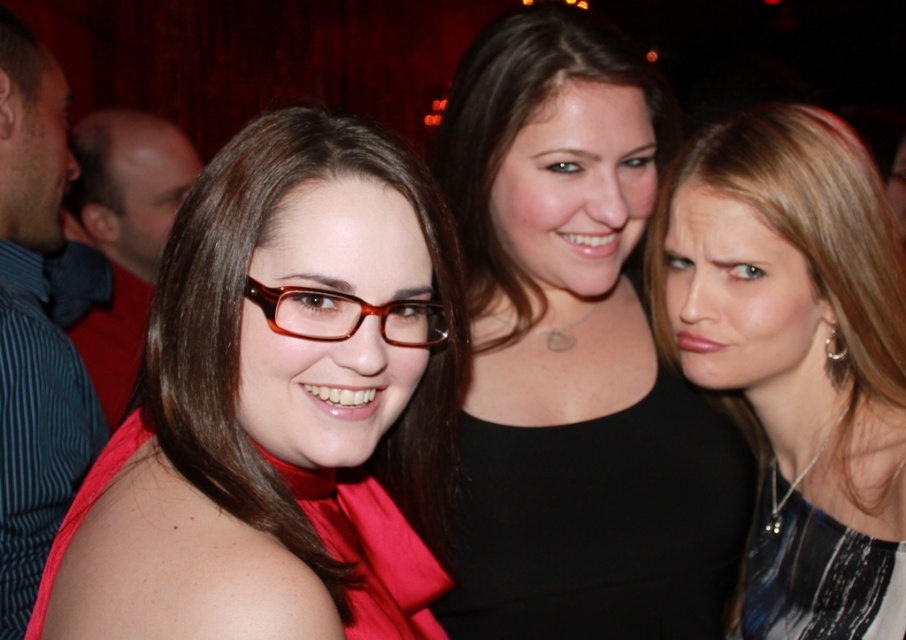
Is point (388, 260) closer to viewer compared to point (400, 305)?

Yes, point (388, 260) is in front of point (400, 305).

Is matte red glasses at center above brown glossy glasses at center?

Incorrect, matte red glasses at center is not positioned above brown glossy glasses at center.

Who is more distant from viewer, [340,618] or [435,320]?

The point [435,320] is more distant.

Locate an element on the screen. The height and width of the screenshot is (640, 906). matte red glasses at center is located at coordinates (281, 404).

Is shiny silver necklace at upper right shorter than black silk dress at lower right?

No.

Which is behind, point (776, 449) or point (895, 554)?

Point (776, 449)

Where is `shiny silver necklace at upper right`? Image resolution: width=906 pixels, height=640 pixels. shiny silver necklace at upper right is located at coordinates (796, 358).

Based on the photo, how much distance is there between black matte dress at center and brown glossy glasses at center?

black matte dress at center and brown glossy glasses at center are 16.32 inches apart.

This screenshot has width=906, height=640. What do you see at coordinates (574, 353) in the screenshot? I see `black matte dress at center` at bounding box center [574, 353].

Where is `black matte dress at center`? black matte dress at center is located at coordinates (574, 353).

Where is `black matte dress at center`? black matte dress at center is located at coordinates (574, 353).